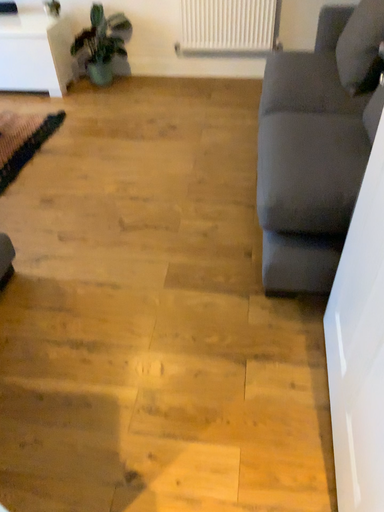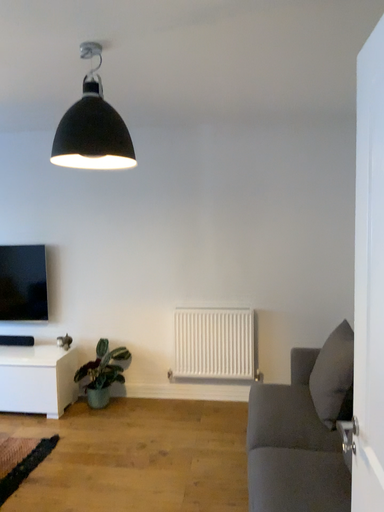
Question: Which way did the camera rotate in the video?

Choices:
 (A) rotated upward
 (B) rotated downward

Answer: (A)